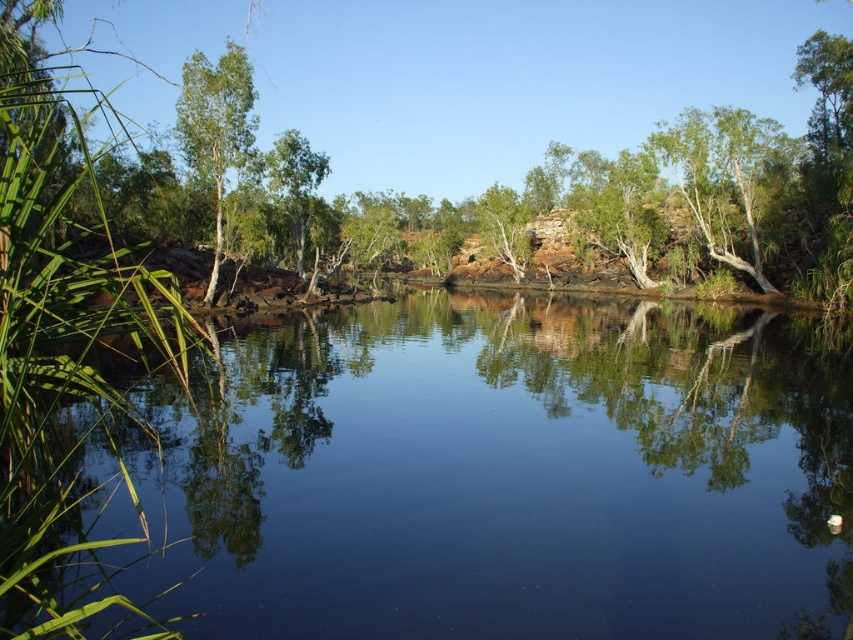
In the scene shown: Which is more to the left, green smooth tree at left or green leafy tree at center?

From the viewer's perspective, green smooth tree at left appears more on the left side.

Does point (204, 81) come in front of point (287, 196)?

Yes, it is.

The image size is (853, 640). Identify the location of green smooth tree at left. (218, 131).

Which is above, clear water at center or green smooth tree at left?

green smooth tree at left

Which is in front, point (648, 301) or point (177, 113)?

Point (648, 301) is more forward.

Is point (320, 608) more distant than point (223, 144)?

That is False.

Locate an element on the screen. clear water at center is located at coordinates (502, 476).

Measure the distance from clear water at center to green leafy tree at center.

clear water at center and green leafy tree at center are 96.89 feet apart.

Is clear water at center to the right of green leafy tree at center from the viewer's perspective?

Correct, you'll find clear water at center to the right of green leafy tree at center.

Describe the element at coordinates (502, 476) in the screenshot. This screenshot has height=640, width=853. I see `clear water at center` at that location.

The height and width of the screenshot is (640, 853). I want to click on clear water at center, so click(x=502, y=476).